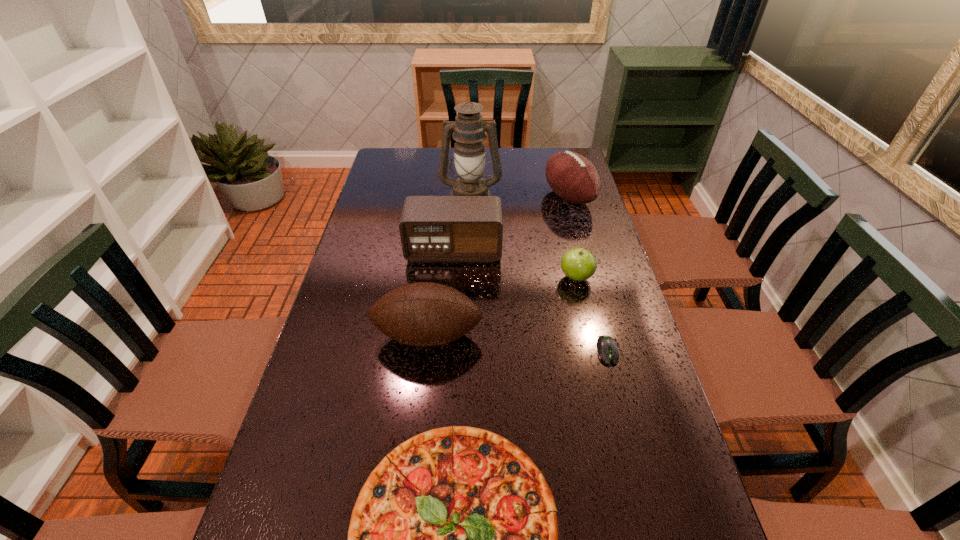
In the image, there is a desktop. Where is `vacant space at the left edge`? This screenshot has height=540, width=960. vacant space at the left edge is located at coordinates (330, 400).

Locate an element on the screen. free location at the right edge of the desktop is located at coordinates (561, 205).

In the image, there is a desktop. Identify the location of vacant area at the far left corner. This screenshot has height=540, width=960. (396, 148).

This screenshot has height=540, width=960. I want to click on free spot between the right football and the fifth tallest object, so click(x=572, y=237).

Find the location of a particular element. free space that is in between the computer mouse and the radio receiver is located at coordinates (531, 301).

The width and height of the screenshot is (960, 540). I want to click on free space between the nearer football and the fourth nearest object, so click(502, 307).

I want to click on free spot between the left football and the third shortest object, so click(502, 307).

Locate an element on the screen. The height and width of the screenshot is (540, 960). vacant area between the oil lamp and the right football is located at coordinates (519, 196).

Identify the location of free space between the right football and the radio receiver. (512, 224).

This screenshot has width=960, height=540. Identify the location of object that is the third nearest to the oil lamp. (578, 264).